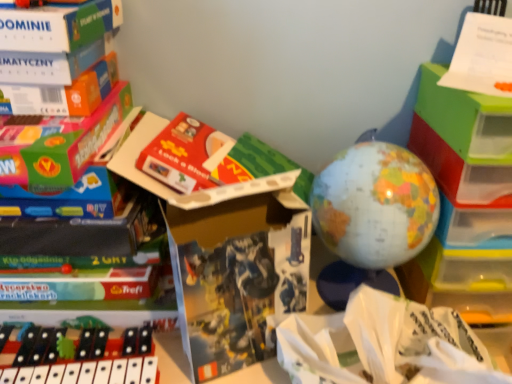
Describe the element at coordinates (372, 216) in the screenshot. The height and width of the screenshot is (384, 512). I see `matte plastic globe at center, the 1th toy from the top` at that location.

How much space does black plastic xylophone at lower left, the first toy when ordered from bottom to top, occupy horizontally?

7.25 inches.

At what (x,y) coordinates should I click in order to perform the action: click on matte plastic globe at center, which is counted as the second toy, starting from the bottom. Please return your answer as a coordinate pair (x, y). Looking at the image, I should click on (372, 216).

Who is shorter, matte cardboard book at center or white paper at center?

Standing shorter between the two is white paper at center.

Is matte cardboard book at center wider than white paper at center?

Incorrect, the width of matte cardboard book at center does not surpass that of white paper at center.

Is matte cardboard book at center not close to white paper at center?

No, there isn't a large distance between matte cardboard book at center and white paper at center.

Is white paper at center bigger than matte plastic globe at center, positioned as the 1th toy in right-to-left order?

Indeed, white paper at center has a larger size compared to matte plastic globe at center, positioned as the 1th toy in right-to-left order.

Could you tell me if white paper at center is facing matte plastic globe at center, positioned as the second toy in left-to-right order?

No, white paper at center is not oriented towards matte plastic globe at center, positioned as the second toy in left-to-right order.

Between white paper at center and matte plastic globe at center, the 1th toy from the top, which one appears on the right side from the viewer's perspective?

Positioned to the right is white paper at center.

Is black plastic xylophone at lower left, which appears as the 1th toy when viewed from the left, smaller than matte cardboard book at center?

Indeed, black plastic xylophone at lower left, which appears as the 1th toy when viewed from the left, has a smaller size compared to matte cardboard book at center.

Considering the relative positions of black plastic xylophone at lower left, which appears as the 1th toy when viewed from the left, and matte cardboard book at center in the image provided, is black plastic xylophone at lower left, which appears as the 1th toy when viewed from the left, behind matte cardboard book at center?

Yes.

Between black plastic xylophone at lower left, which appears as the second toy when viewed from the top, and matte cardboard book at center, which one has larger width?

With larger width is black plastic xylophone at lower left, which appears as the second toy when viewed from the top.

In terms of size, does black plastic xylophone at lower left, which appears as the second toy when viewed from the top, appear bigger or smaller than matte plastic globe at center, the 1th toy from the top?

Considering their sizes, black plastic xylophone at lower left, which appears as the second toy when viewed from the top, takes up less space than matte plastic globe at center, the 1th toy from the top.

Could you tell me if black plastic xylophone at lower left, which appears as the second toy when viewed from the top, is turned towards matte plastic globe at center, positioned as the 1th toy in right-to-left order?

No, black plastic xylophone at lower left, which appears as the second toy when viewed from the top, does not turn towards matte plastic globe at center, positioned as the 1th toy in right-to-left order.

Is black plastic xylophone at lower left, which appears as the 1th toy when viewed from the left, positioned far away from matte plastic globe at center, the 1th toy from the top?

No, black plastic xylophone at lower left, which appears as the 1th toy when viewed from the left, is not far from matte plastic globe at center, the 1th toy from the top.

From the image's perspective, which is below, matte plastic globe at center, positioned as the second toy in left-to-right order, or white paper at center?

white paper at center appears lower in the image.

From a real-world perspective, is matte plastic globe at center, which is counted as the second toy, starting from the bottom, below white paper at center?

No, from a real-world perspective, matte plastic globe at center, which is counted as the second toy, starting from the bottom, is not beneath white paper at center.

Visually, is matte plastic globe at center, the 1th toy from the top, positioned to the left or to the right of white paper at center?

From the image, it's evident that matte plastic globe at center, the 1th toy from the top, is to the left of white paper at center.

Which point is more forward, (332, 240) or (390, 372)?

Point (390, 372)

Where is `paperback book that is below the matte plastic globe at center, which is counted as the second toy, starting from the bottom (from the image's perspective)`? paperback book that is below the matte plastic globe at center, which is counted as the second toy, starting from the bottom (from the image's perspective) is located at coordinates (236, 277).

From the picture: From a real-world perspective, is matte cardboard book at center located higher than matte plastic globe at center, the 1th toy from the top?

No.

Is matte cardboard book at center behind matte plastic globe at center, the 1th toy from the top?

No, the depth of matte cardboard book at center is less than that of matte plastic globe at center, the 1th toy from the top.

Could you tell me if matte cardboard book at center is turned towards matte plastic globe at center, positioned as the 1th toy in right-to-left order?

No, matte cardboard book at center is not aimed at matte plastic globe at center, positioned as the 1th toy in right-to-left order.

Which is more to the right, white paper at center or matte cardboard book at center?

Positioned to the right is white paper at center.

Is white paper at center smaller than matte cardboard book at center?

No, white paper at center is not smaller than matte cardboard book at center.

Who is taller, white paper at center or matte cardboard book at center?

matte cardboard book at center.

Would you say white paper at center is a long distance from matte cardboard book at center?

white paper at center is near matte cardboard book at center, not far away.

Where is `paperback book lying on the left of white paper at center`? The height and width of the screenshot is (384, 512). paperback book lying on the left of white paper at center is located at coordinates (236, 277).

You are a GUI agent. You are given a task and a screenshot of the screen. Output one action in this format:
    pyautogui.click(x=<x>, y=<y>)
    Task: Click on the wrapping paper located underneath the matte plastic globe at center, which is counted as the second toy, starting from the bottom (from a real-world perspective)
    The height and width of the screenshot is (384, 512).
    Given the screenshot: What is the action you would take?
    pyautogui.click(x=383, y=344)

Based on the photo, looking at the image, which one is located closer to black plastic xylophone at lower left, which appears as the 1th toy when viewed from the left, matte plastic globe at center, which is counted as the second toy, starting from the bottom, or white paper at center?

white paper at center is closer to black plastic xylophone at lower left, which appears as the 1th toy when viewed from the left.

Considering their positions, is matte cardboard book at center positioned further to white paper at center than matte plastic globe at center, which is counted as the second toy, starting from the bottom?

Based on the image, matte plastic globe at center, which is counted as the second toy, starting from the bottom, appears to be further to white paper at center.

When comparing their distances from matte plastic globe at center, the 1th toy from the top, does matte cardboard book at center or white paper at center seem further?

Based on the image, matte cardboard book at center appears to be further to matte plastic globe at center, the 1th toy from the top.

When comparing their distances from white paper at center, does black plastic xylophone at lower left, which appears as the second toy when viewed from the top, or matte cardboard book at center seem further?

black plastic xylophone at lower left, which appears as the second toy when viewed from the top, lies further to white paper at center than the other object.

Estimate the real-world distances between objects in this image. Which object is further from matte cardboard book at center, matte plastic globe at center, positioned as the 1th toy in right-to-left order, or black plastic xylophone at lower left, which appears as the 1th toy when viewed from the left?

The object further to matte cardboard book at center is black plastic xylophone at lower left, which appears as the 1th toy when viewed from the left.

From the image, which object appears to be nearer to white paper at center, matte cardboard book at center or black plastic xylophone at lower left, placed as the second toy when sorted from right to left?

matte cardboard book at center.

Which object lies nearer to the anchor point black plastic xylophone at lower left, the first toy when ordered from bottom to top, matte cardboard book at center or matte plastic globe at center, which is counted as the second toy, starting from the bottom?

The object closer to black plastic xylophone at lower left, the first toy when ordered from bottom to top, is matte cardboard book at center.

Looking at the image, which one is located further to matte plastic globe at center, positioned as the 1th toy in right-to-left order, white paper at center or black plastic xylophone at lower left, placed as the second toy when sorted from right to left?

black plastic xylophone at lower left, placed as the second toy when sorted from right to left, lies further to matte plastic globe at center, positioned as the 1th toy in right-to-left order, than the other object.

Find the location of a particular element. This screenshot has height=384, width=512. paperback book located between black plastic xylophone at lower left, which appears as the 1th toy when viewed from the left, and white paper at center in the left-right direction is located at coordinates (236, 277).

Where is `toy between matte cardboard book at center and white paper at center in the horizontal direction`? toy between matte cardboard book at center and white paper at center in the horizontal direction is located at coordinates (372, 216).

Locate an element on the screen. The image size is (512, 384). paperback book between black plastic xylophone at lower left, placed as the second toy when sorted from right to left, and matte plastic globe at center, positioned as the second toy in left-to-right order is located at coordinates (236, 277).

Where is `toy located between black plastic xylophone at lower left, the first toy when ordered from bottom to top, and white paper at center in the left-right direction`? Image resolution: width=512 pixels, height=384 pixels. toy located between black plastic xylophone at lower left, the first toy when ordered from bottom to top, and white paper at center in the left-right direction is located at coordinates (372, 216).